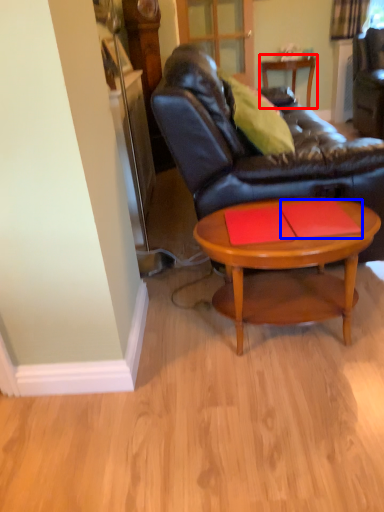
Question: Which of the following is the closest to the observer, table (highlighted by a red box) or plank (highlighted by a blue box)?

Choices:
 (A) table
 (B) plank

Answer: (B)